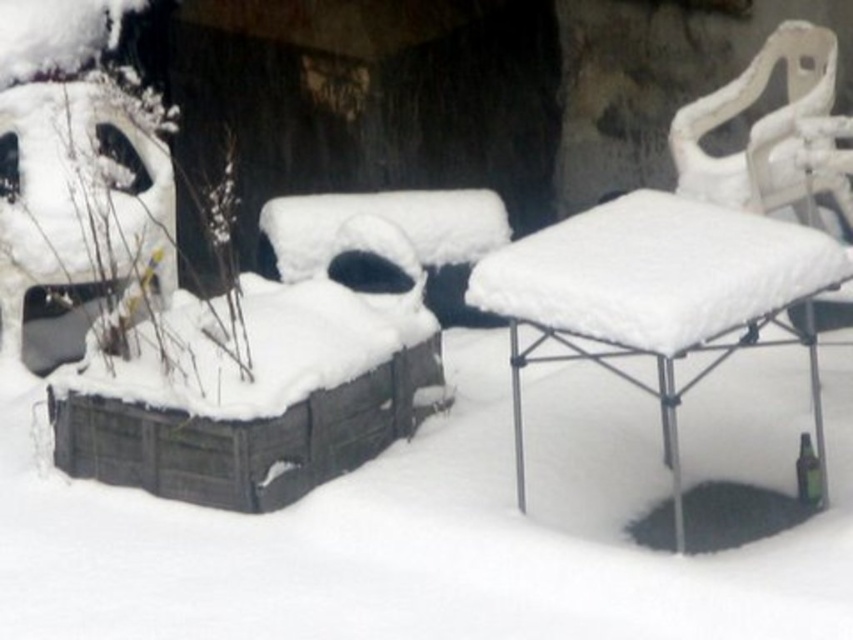
Does white fluffy table at center have a greater width compared to white plastic chair at upper right?

Indeed, white fluffy table at center has a greater width compared to white plastic chair at upper right.

Is white fluffy table at center behind white plastic chair at upper right?

That is False.

The height and width of the screenshot is (640, 853). Describe the element at coordinates (657, 296) in the screenshot. I see `white fluffy table at center` at that location.

Find the location of a particular element. Image resolution: width=853 pixels, height=640 pixels. white fluffy table at center is located at coordinates (657, 296).

Is white matte panda at left below white plastic chair at upper right?

Indeed, white matte panda at left is positioned under white plastic chair at upper right.

Which is in front, point (6, 202) or point (720, 104)?

Point (6, 202) is in front.

Which is in front, point (149, 168) or point (711, 170)?

Point (711, 170) is more forward.

Locate an element on the screen. The height and width of the screenshot is (640, 853). white matte panda at left is located at coordinates (74, 212).

The width and height of the screenshot is (853, 640). In order to click on white fluffy table at center in this screenshot , I will do `click(657, 296)`.

Does point (532, 237) come behind point (57, 296)?

No, it is not.

Find the location of a particular element. The image size is (853, 640). white fluffy table at center is located at coordinates (657, 296).

Image resolution: width=853 pixels, height=640 pixels. What are the coordinates of `white fluffy table at center` in the screenshot? It's located at (657, 296).